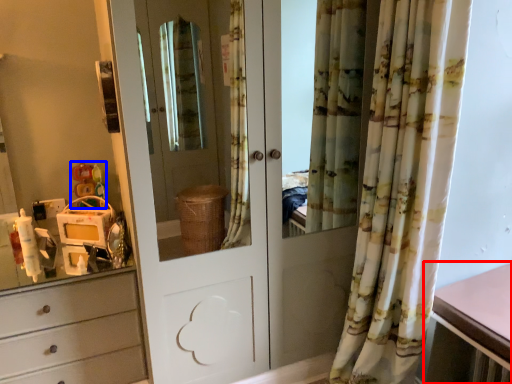
Question: Which of the following is the farthest to the observer, table (highlighted by a red box) or toy (highlighted by a blue box)?

Choices:
 (A) table
 (B) toy

Answer: (B)